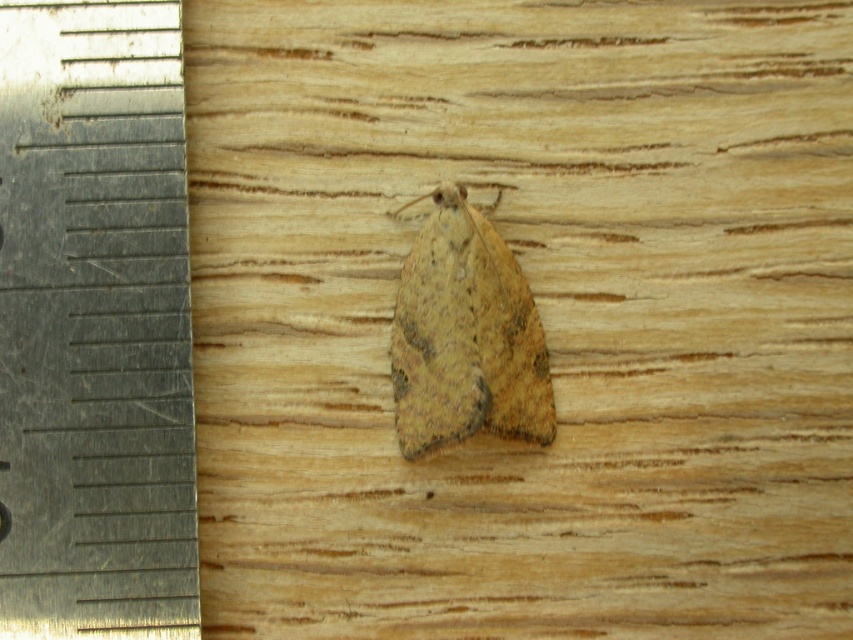
You are standing in front of the wooden surface where the moth is resting. You notice two points marked on the surface at coordinates point (4, 138) and point (486, 308). Which point is nearer to you?

Point (4, 138) is closer to the viewer than point (486, 308).